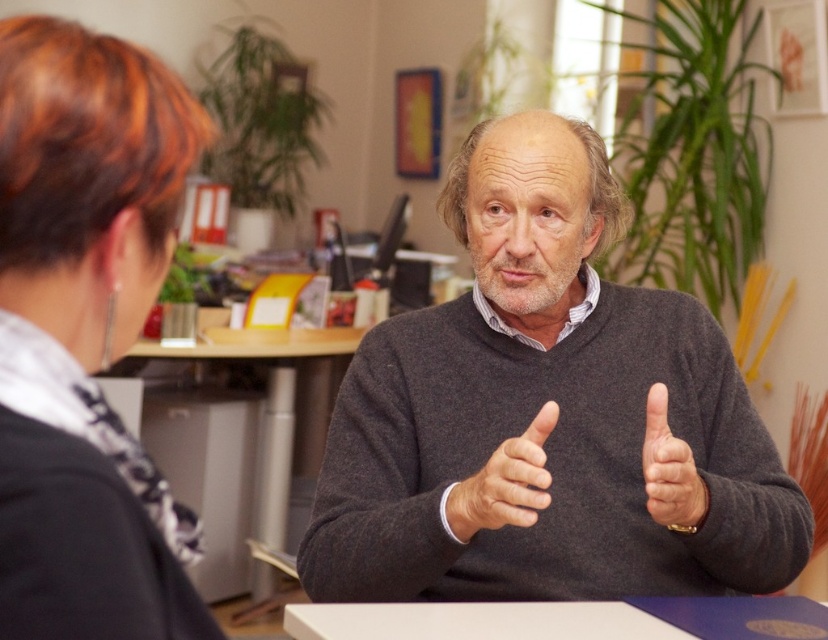
Who is positioned more to the left, dark gray sweater at center or white matte table at center?

From the viewer's perspective, dark gray sweater at center appears more on the left side.

I want to click on dark gray sweater at center, so click(542, 413).

Where is `dark gray sweater at center`? This screenshot has width=828, height=640. dark gray sweater at center is located at coordinates [x=542, y=413].

Can you confirm if dark gray sweater at center is positioned to the right of black fabric hair at upper left?

Correct, you'll find dark gray sweater at center to the right of black fabric hair at upper left.

Which is below, dark gray sweater at center or black fabric hair at upper left?

dark gray sweater at center is lower down.

Where is `dark gray sweater at center`? This screenshot has width=828, height=640. dark gray sweater at center is located at coordinates (542, 413).

The width and height of the screenshot is (828, 640). In order to click on dark gray sweater at center in this screenshot , I will do `click(542, 413)`.

How much distance is there between dark gray sweater at center and gray matte hand at center?

They are 9.32 inches apart.

Can you confirm if dark gray sweater at center is positioned to the left of gray matte hand at center?

Yes, dark gray sweater at center is to the left of gray matte hand at center.

This screenshot has width=828, height=640. What are the coordinates of `dark gray sweater at center` in the screenshot? It's located at (542, 413).

This screenshot has width=828, height=640. What are the coordinates of `dark gray sweater at center` in the screenshot? It's located at (542, 413).